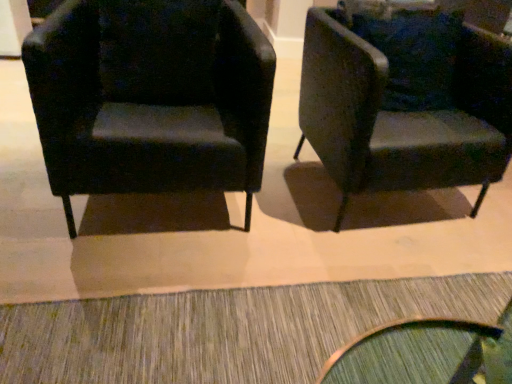
The width and height of the screenshot is (512, 384). What do you see at coordinates (150, 97) in the screenshot? I see `matte black armchair at left, the 2th chair viewed from the right` at bounding box center [150, 97].

Identify the location of matte black armchair at left, the 2th chair viewed from the right. The height and width of the screenshot is (384, 512). (150, 97).

You are a GUI agent. You are given a task and a screenshot of the screen. Output one action in this format:
    pyautogui.click(x=<x>, y=<y>)
    Task: Click on the textured gray doormat at lower center
    Image resolution: width=512 pixels, height=384 pixels.
    Given the screenshot: What is the action you would take?
    pyautogui.click(x=223, y=330)

Is matte black armchair at left, acting as the first chair starting from the left, at the back of textured gray doormat at lower center?

That's not correct — textured gray doormat at lower center is not looking away from matte black armchair at left, acting as the first chair starting from the left.

Measure the distance from textured gray doormat at lower center to matte black armchair at left, the 2th chair viewed from the right.

textured gray doormat at lower center and matte black armchair at left, the 2th chair viewed from the right, are 64.72 centimeters apart from each other.

Consider the image. Would you say textured gray doormat at lower center is a long distance from matte black armchair at left, acting as the first chair starting from the left?

No, textured gray doormat at lower center is in close proximity to matte black armchair at left, acting as the first chair starting from the left.

Would you say textured gray doormat at lower center is outside matte black armchair at left, the 2th chair viewed from the right?

Yes, textured gray doormat at lower center is outside of matte black armchair at left, the 2th chair viewed from the right.

From a real-world perspective, is matte black armchair at left, acting as the first chair starting from the left, on velvet dark green armchair at right, the first chair when ordered from right to left?

Yes.

Which is more to the left, matte black armchair at left, the 2th chair viewed from the right, or velvet dark green armchair at right, which is the second chair from left to right?

matte black armchair at left, the 2th chair viewed from the right.

Does matte black armchair at left, acting as the first chair starting from the left, come in front of velvet dark green armchair at right, which is the second chair from left to right?

Yes.

Does point (149, 151) lie in front of point (484, 64)?

Yes, it is in front of point (484, 64).

How many degrees apart are the facing directions of velvet dark green armchair at right, which is the second chair from left to right, and textured gray doormat at lower center?

The facing directions of velvet dark green armchair at right, which is the second chair from left to right, and textured gray doormat at lower center are 180 degrees apart.

From the image's perspective, between velvet dark green armchair at right, which is the second chair from left to right, and textured gray doormat at lower center, which one is located above?

velvet dark green armchair at right, which is the second chair from left to right, from the image's perspective.

From the picture: Is velvet dark green armchair at right, the first chair when ordered from right to left, facing away from textured gray doormat at lower center?

velvet dark green armchair at right, the first chair when ordered from right to left, is not turned away from textured gray doormat at lower center.

Between velvet dark green armchair at right, the first chair when ordered from right to left, and textured gray doormat at lower center, which one has larger size?

Bigger between the two is velvet dark green armchair at right, the first chair when ordered from right to left.

From a real-world perspective, who is located higher, velvet dark green armchair at right, which is the second chair from left to right, or matte black armchair at left, acting as the first chair starting from the left?

matte black armchair at left, acting as the first chair starting from the left, is physically above.

How different are the orientations of velvet dark green armchair at right, the first chair when ordered from right to left, and matte black armchair at left, acting as the first chair starting from the left, in degrees?

Answer: The angle between the facing direction of velvet dark green armchair at right, the first chair when ordered from right to left, and the facing direction of matte black armchair at left, acting as the first chair starting from the left, is 0.00055 degrees.

Is there a large distance between velvet dark green armchair at right, which is the second chair from left to right, and matte black armchair at left, the 2th chair viewed from the right?

Actually, velvet dark green armchair at right, which is the second chair from left to right, and matte black armchair at left, the 2th chair viewed from the right, are a little close together.

From the image's perspective, is velvet dark green armchair at right, which is the second chair from left to right, positioned above or below matte black armchair at left, acting as the first chair starting from the left?

velvet dark green armchair at right, which is the second chair from left to right, is above matte black armchair at left, acting as the first chair starting from the left.

Is the surface of textured gray doormat at lower center in direct contact with velvet dark green armchair at right, which is the second chair from left to right?

No, textured gray doormat at lower center is not beside velvet dark green armchair at right, which is the second chair from left to right.

Is velvet dark green armchair at right, the first chair when ordered from right to left, inside textured gray doormat at lower center?

No, velvet dark green armchair at right, the first chair when ordered from right to left, is located outside of textured gray doormat at lower center.

Based on their sizes in the image, would you say textured gray doormat at lower center is bigger or smaller than velvet dark green armchair at right, the first chair when ordered from right to left?

Clearly, textured gray doormat at lower center is smaller in size than velvet dark green armchair at right, the first chair when ordered from right to left.

From a real-world perspective, which is physically above, matte black armchair at left, acting as the first chair starting from the left, or textured gray doormat at lower center?

matte black armchair at left, acting as the first chair starting from the left.

Which object is more forward, matte black armchair at left, the 2th chair viewed from the right, or textured gray doormat at lower center?

textured gray doormat at lower center is in front.

Would you say matte black armchair at left, the 2th chair viewed from the right, is to the left or to the right of textured gray doormat at lower center in the picture?

matte black armchair at left, the 2th chair viewed from the right, is positioned on textured gray doormat at lower center's left side.

In terms of width, does matte black armchair at left, the 2th chair viewed from the right, look wider or thinner when compared to textured gray doormat at lower center?

Clearly, matte black armchair at left, the 2th chair viewed from the right, has more width compared to textured gray doormat at lower center.

You are a GUI agent. You are given a task and a screenshot of the screen. Output one action in this format:
    pyautogui.click(x=<x>, y=<y>)
    Task: Click on the doormat that is under the matte black armchair at left, the 2th chair viewed from the right (from a real-world perspective)
    This screenshot has width=512, height=384.
    Given the screenshot: What is the action you would take?
    pyautogui.click(x=223, y=330)

What are the coordinates of `chair located above the velvet dark green armchair at right, the first chair when ordered from right to left (from a real-world perspective)` in the screenshot? It's located at tap(150, 97).

Estimate the real-world distances between objects in this image. Which object is closer to velvet dark green armchair at right, which is the second chair from left to right, textured gray doormat at lower center or matte black armchair at left, the 2th chair viewed from the right?

Among the two, matte black armchair at left, the 2th chair viewed from the right, is located nearer to velvet dark green armchair at right, which is the second chair from left to right.

Based on their spatial positions, is matte black armchair at left, the 2th chair viewed from the right, or textured gray doormat at lower center further from velvet dark green armchair at right, which is the second chair from left to right?

Based on the image, textured gray doormat at lower center appears to be further to velvet dark green armchair at right, which is the second chair from left to right.

Based on their spatial positions, is matte black armchair at left, the 2th chair viewed from the right, or velvet dark green armchair at right, which is the second chair from left to right, closer to textured gray doormat at lower center?

Based on the image, matte black armchair at left, the 2th chair viewed from the right, appears to be nearer to textured gray doormat at lower center.

From the image, which object appears to be farther from matte black armchair at left, the 2th chair viewed from the right, textured gray doormat at lower center or velvet dark green armchair at right, which is the second chair from left to right?

The object further to matte black armchair at left, the 2th chair viewed from the right, is textured gray doormat at lower center.

Considering their positions, is velvet dark green armchair at right, which is the second chair from left to right, positioned further to textured gray doormat at lower center than matte black armchair at left, the 2th chair viewed from the right?

Among the two, velvet dark green armchair at right, which is the second chair from left to right, is located further to textured gray doormat at lower center.

From the image, which object appears to be nearer to matte black armchair at left, the 2th chair viewed from the right, velvet dark green armchair at right, which is the second chair from left to right, or textured gray doormat at lower center?

The object closer to matte black armchair at left, the 2th chair viewed from the right, is velvet dark green armchair at right, which is the second chair from left to right.

Where is `doormat situated between matte black armchair at left, acting as the first chair starting from the left, and velvet dark green armchair at right, the first chair when ordered from right to left, from left to right`? The image size is (512, 384). doormat situated between matte black armchair at left, acting as the first chair starting from the left, and velvet dark green armchair at right, the first chair when ordered from right to left, from left to right is located at coordinates (223, 330).